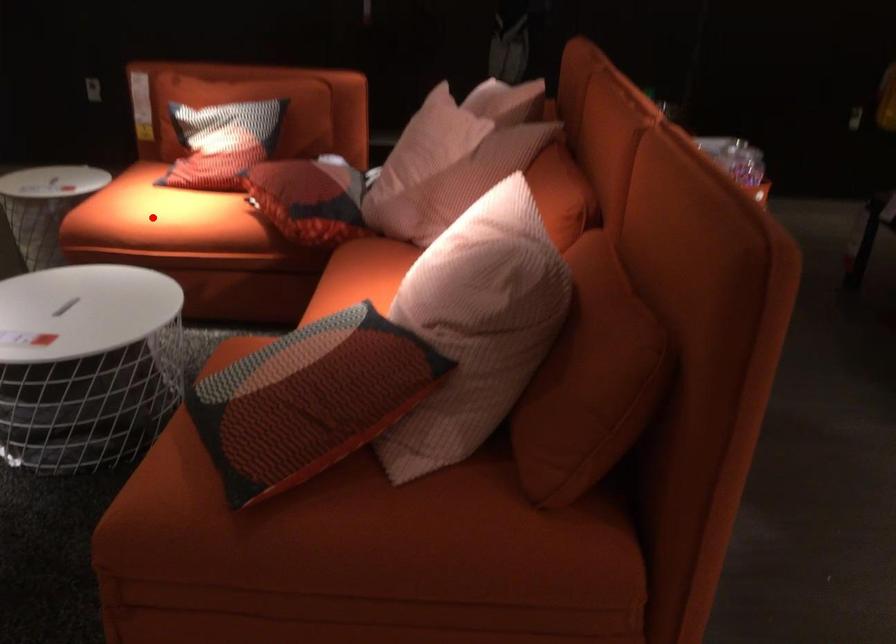
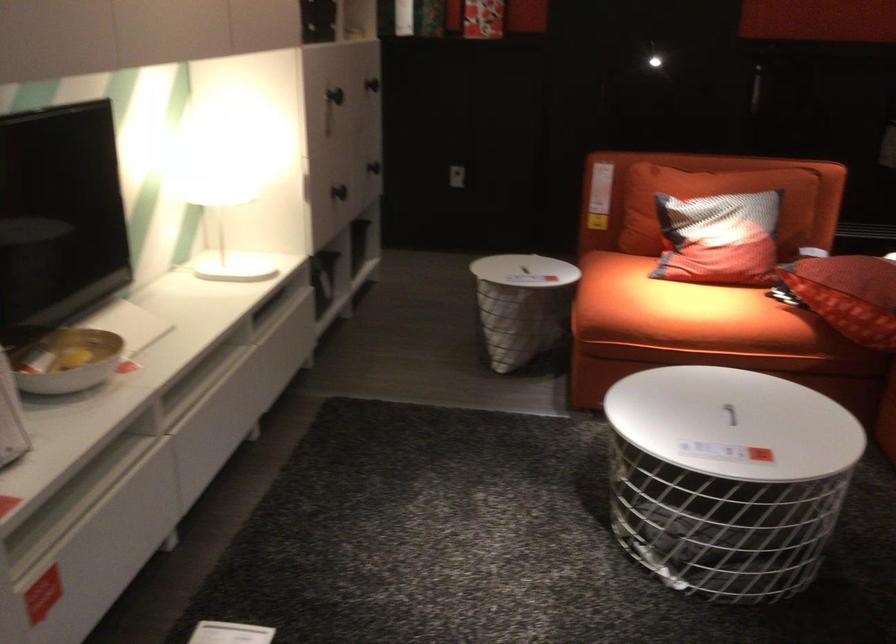
Where in the second image is the point corresponding to the highlighted location from the first image?

(684, 312)